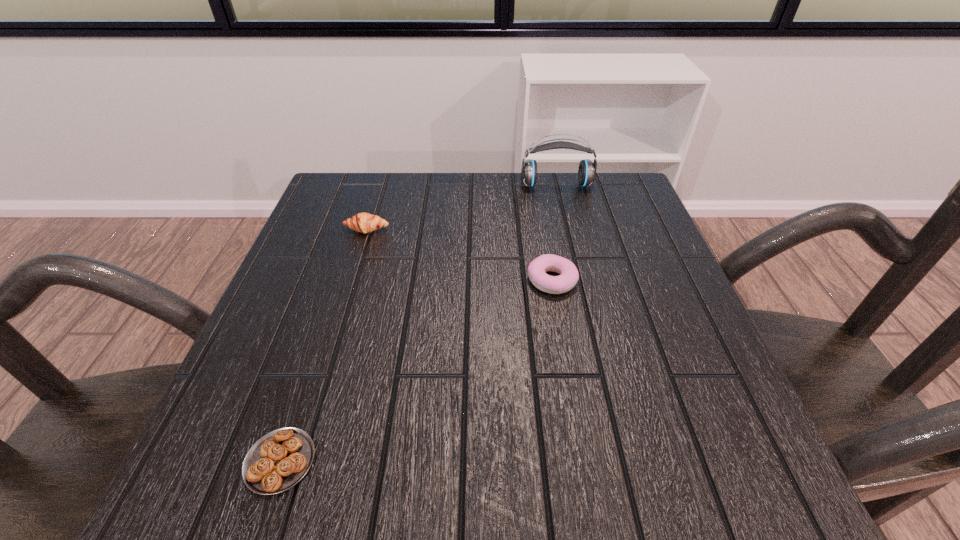
The height and width of the screenshot is (540, 960). I want to click on the tallest object, so point(587,169).

You are a GUI agent. You are given a task and a screenshot of the screen. Output one action in this format:
    pyautogui.click(x=<x>, y=<y>)
    Task: Click on the headset
    The image size is (960, 540).
    Given the screenshot: What is the action you would take?
    pyautogui.click(x=587, y=169)

Where is `the third nearest object`? the third nearest object is located at coordinates (362, 222).

Where is `the rightmost pastry`? the rightmost pastry is located at coordinates (537, 269).

The image size is (960, 540). What are the coordinates of `the second nearest pastry` in the screenshot? It's located at (537, 269).

Where is `the nearest pastry`? This screenshot has width=960, height=540. the nearest pastry is located at coordinates (280, 459).

Where is `the nearest object`? The width and height of the screenshot is (960, 540). the nearest object is located at coordinates (280, 459).

Identify the location of vacant space situated on the ear cups of the headset. The width and height of the screenshot is (960, 540). (574, 258).

In order to click on free space located on the front-facing side of the third nearest object in this screenshot , I will do `click(345, 300)`.

You are a GUI agent. You are given a task and a screenshot of the screen. Output one action in this format:
    pyautogui.click(x=<x>, y=<y>)
    Task: Click on the free space located 0.230m on the back of the second farthest pastry
    This screenshot has width=960, height=540.
    Given the screenshot: What is the action you would take?
    tap(539, 203)